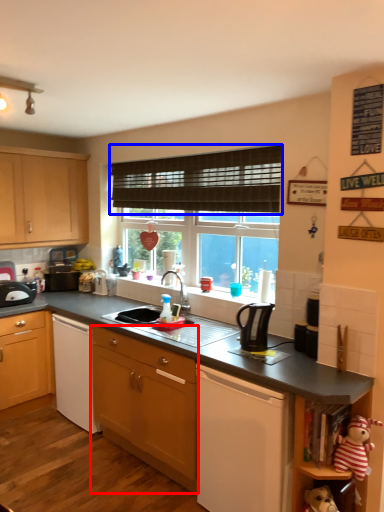
Question: Among these objects, which one is farthest to the camera, cabinetry (highlighted by a red box) or blind (highlighted by a blue box)?

Choices:
 (A) cabinetry
 (B) blind

Answer: (B)